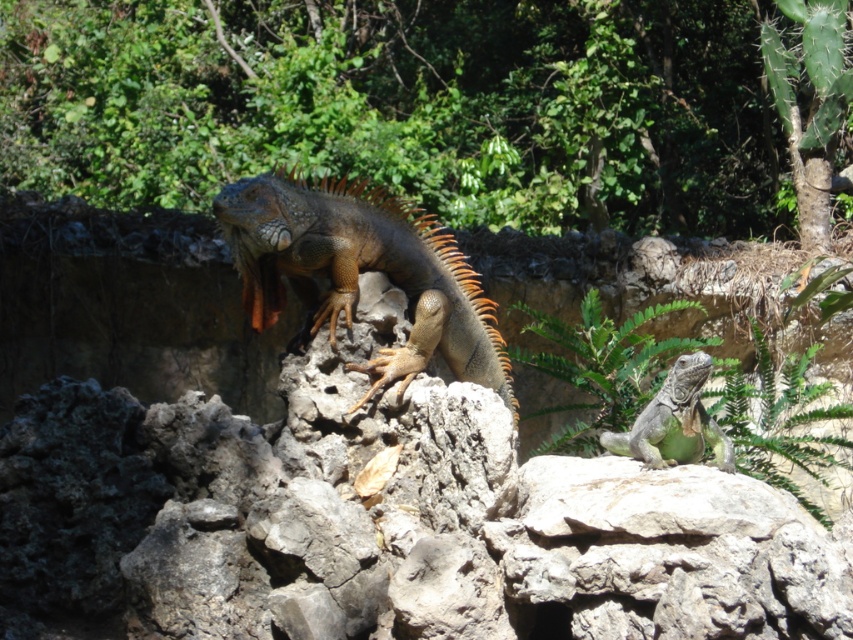
You are a wildlife photographer aiming to capture both the shiny brown iguana at center and the green scaly lizard at center in a single shot. Based on their positions, which one is positioned higher in the frame?

The shiny brown iguana at center is located above the green scaly lizard at center, so it is positioned higher in the frame.

In the scene shown: Based on the coordinates provided, where is the shiny brown iguana at center located in the image?

The shiny brown iguana at center is located at the coordinates point (361, 269).